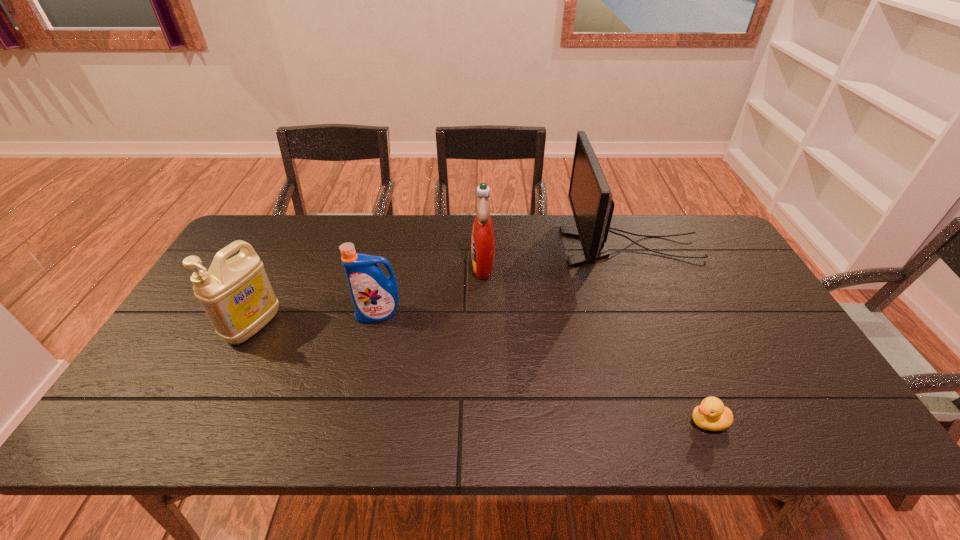
You are a GUI agent. You are given a task and a screenshot of the screen. Output one action in this format:
    pyautogui.click(x=<x>, y=<y>)
    Task: Click on the computer monitor
    The width and height of the screenshot is (960, 540).
    Given the screenshot: What is the action you would take?
    pyautogui.click(x=590, y=197)

Where is `the farthest detergent`? This screenshot has height=540, width=960. the farthest detergent is located at coordinates (483, 238).

Find the location of a particular element. This screenshot has width=960, height=540. the third object from left to right is located at coordinates (483, 238).

The width and height of the screenshot is (960, 540). Find the location of `the leftmost object`. the leftmost object is located at coordinates (236, 294).

Image resolution: width=960 pixels, height=540 pixels. Find the location of `the fourth object from right to left`. the fourth object from right to left is located at coordinates (375, 296).

This screenshot has width=960, height=540. What are the coordinates of `the nearest object` in the screenshot? It's located at (711, 415).

Where is `the shortest object`? The image size is (960, 540). the shortest object is located at coordinates (711, 415).

Locate an element on the screen. The height and width of the screenshot is (540, 960). vacant position located 0.230m on the screen side of the computer monitor is located at coordinates (493, 247).

This screenshot has width=960, height=540. I want to click on free spot located 0.210m on the screen side of the computer monitor, so [x=499, y=247].

Image resolution: width=960 pixels, height=540 pixels. What are the coordinates of `free space located on the screen side of the computer monitor` in the screenshot? It's located at (506, 247).